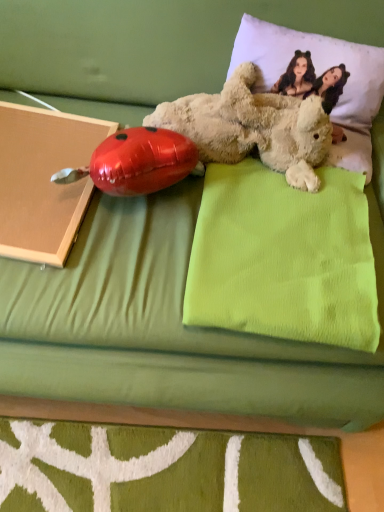
Question: From the image's perspective, is white soft pillow at upper right, which is counted as the second pillow, starting from the bottom, over fluffy beige teddy bear at upper right?

Choices:
 (A) no
 (B) yes

Answer: (B)

Question: Is the position of white soft pillow at upper right, the 1th pillow viewed from the top, more distant than that of fluffy beige teddy bear at upper right?

Choices:
 (A) no
 (B) yes

Answer: (B)

Question: Can you see white soft pillow at upper right, which is counted as the second pillow, starting from the bottom, touching fluffy beige teddy bear at upper right?

Choices:
 (A) no
 (B) yes

Answer: (A)

Question: Considering the relative positions of white soft pillow at upper right, which is counted as the second pillow, starting from the bottom, and fluffy beige teddy bear at upper right in the image provided, is white soft pillow at upper right, which is counted as the second pillow, starting from the bottom, to the left of fluffy beige teddy bear at upper right from the viewer's perspective?

Choices:
 (A) yes
 (B) no

Answer: (B)

Question: Is white soft pillow at upper right, the 1th pillow viewed from the top, oriented away from fluffy beige teddy bear at upper right?

Choices:
 (A) yes
 (B) no

Answer: (B)

Question: Is green fabric pillow at upper center, which is the 2th pillow from top to bottom, in front of or behind shiny metallic ladybug at left in the image?

Choices:
 (A) front
 (B) behind

Answer: (A)

Question: In terms of width, does green fabric pillow at upper center, which is the 2th pillow from top to bottom, look wider or thinner when compared to shiny metallic ladybug at left?

Choices:
 (A) wide
 (B) thin

Answer: (A)

Question: Is point (362, 330) positioned closer to the camera than point (117, 189)?

Choices:
 (A) farther
 (B) closer

Answer: (B)

Question: Is green fabric pillow at upper center, which is the 2th pillow from top to bottom, taller or shorter than shiny metallic ladybug at left?

Choices:
 (A) short
 (B) tall

Answer: (A)

Question: From the image's perspective, is matte cardboard book at left above or below white soft pillow at upper right, the 1th pillow viewed from the top?

Choices:
 (A) below
 (B) above

Answer: (A)

Question: Considering their positions, is matte cardboard book at left located in front of or behind white soft pillow at upper right, the 1th pillow viewed from the top?

Choices:
 (A) behind
 (B) front

Answer: (B)

Question: Is matte cardboard book at left spatially inside white soft pillow at upper right, which is counted as the second pillow, starting from the bottom, or outside of it?

Choices:
 (A) outside
 (B) inside

Answer: (A)

Question: From a real-world perspective, is matte cardboard book at left positioned above or below white soft pillow at upper right, which is counted as the second pillow, starting from the bottom?

Choices:
 (A) below
 (B) above

Answer: (A)

Question: In the image, is green fabric pillow at upper center, which is the 2th pillow from top to bottom, positioned in front of or behind fluffy beige teddy bear at upper right?

Choices:
 (A) front
 (B) behind

Answer: (A)

Question: Looking at their shapes, would you say green fabric pillow at upper center, placed as the first pillow when sorted from bottom to top, is wider or thinner than fluffy beige teddy bear at upper right?

Choices:
 (A) wide
 (B) thin

Answer: (A)